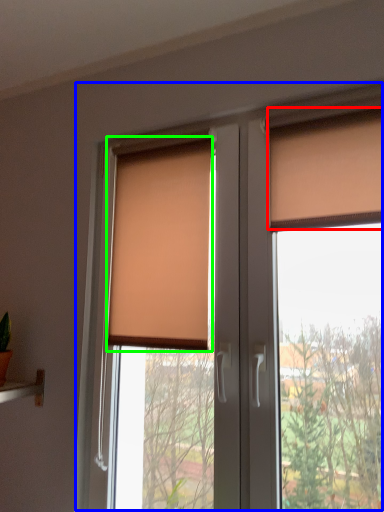
Question: Based on their relative distances, which object is farther from curtain (highlighted by a red box)? Choose from window (highlighted by a blue box) and window blind (highlighted by a green box).

Choices:
 (A) window
 (B) window blind

Answer: (B)